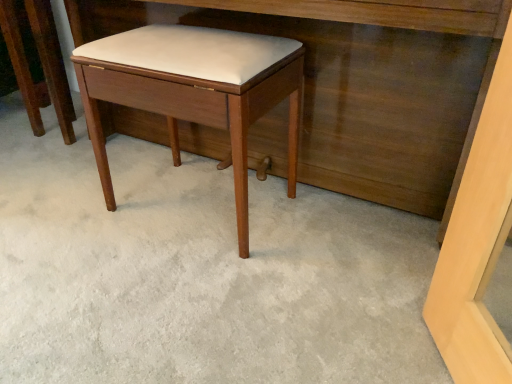
Locate an element on the screen. free area in between matte wood stool at center and matte wood stool at center is located at coordinates (115, 161).